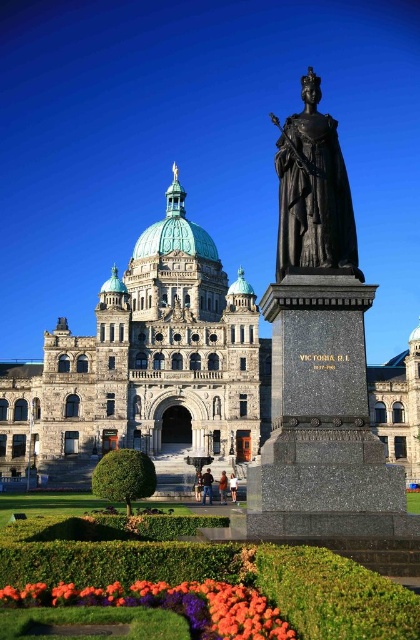
You are a tour guide leading a group and want to ensure everyone can see both the stone building at center and the black polished granite statue at center from a single vantage point. Given that the group needs a minimum of 50 feet of space to gather comfortably, is this possible?

The stone building at center and the black polished granite statue at center are 72.49 feet apart, which is more than the required 50 feet. Therefore, the group can gather at a distance where both are visible from a single vantage point.

You are a tourist standing at the entrance of the government building and see the bronze statue at center. If you want to take a closer look, how many steps do you need to take to reach it?

The bronze statue at center is 164.23 feet from viewer. Assuming an average step length of 2.5 feet, you would need to take approximately 66 steps to reach the bronze statue at center.